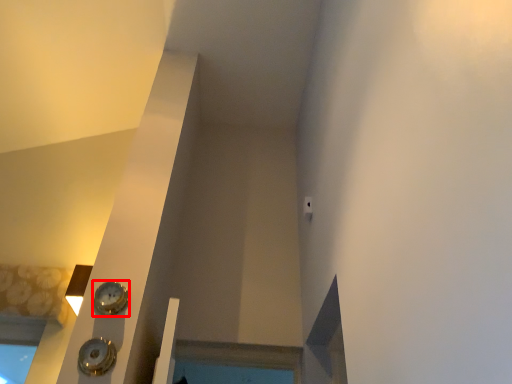
Question: From the image's perspective, where is clock (annotated by the red box) located relative to clock?

Choices:
 (A) below
 (B) above

Answer: (B)